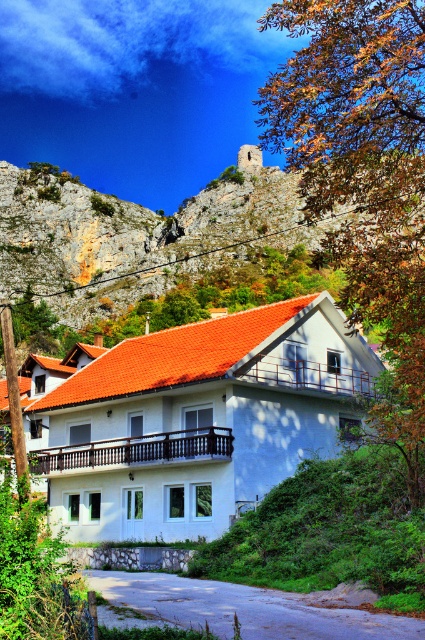
Question: Which point is farther to the camera?

Choices:
 (A) brown leafy tree at upper right
 (B) rustic stone wall at upper center

Answer: (B)

Question: Which object is farther from the camera taking this photo?

Choices:
 (A) rustic stone wall at upper center
 (B) brown leafy tree at upper right

Answer: (A)

Question: Does brown leafy tree at upper right come behind rustic stone wall at upper center?

Choices:
 (A) yes
 (B) no

Answer: (B)

Question: Is brown leafy tree at upper right bigger than rustic stone wall at upper center?

Choices:
 (A) no
 (B) yes

Answer: (B)

Question: Can you confirm if brown leafy tree at upper right is positioned above rustic stone wall at upper center?

Choices:
 (A) no
 (B) yes

Answer: (B)